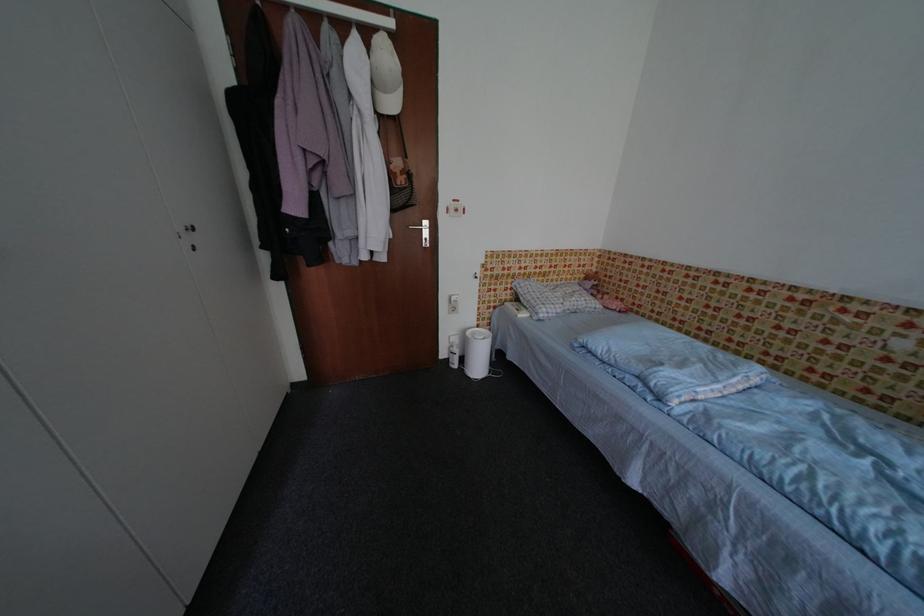
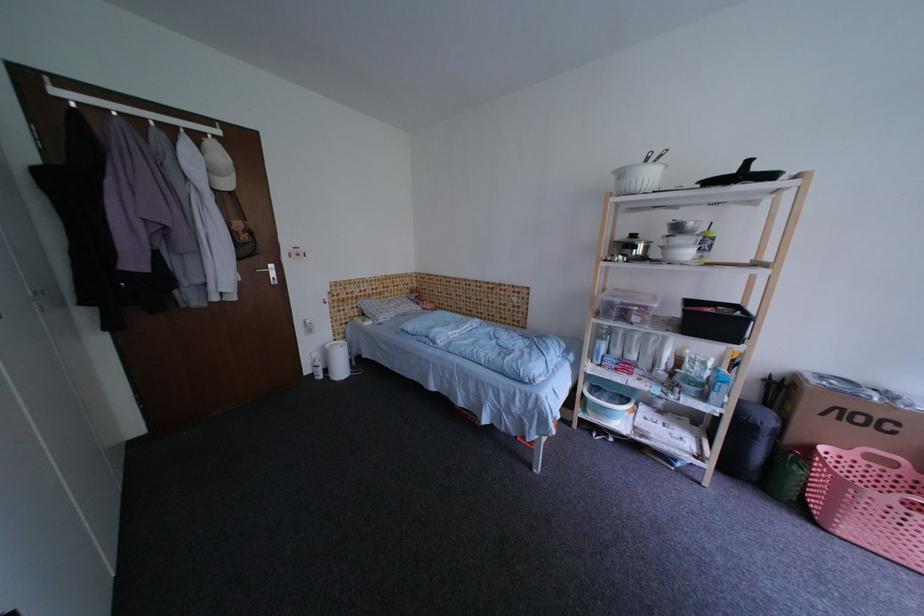
Where in the second image is the point corresponding to point 395,60 from the first image?

(227, 158)